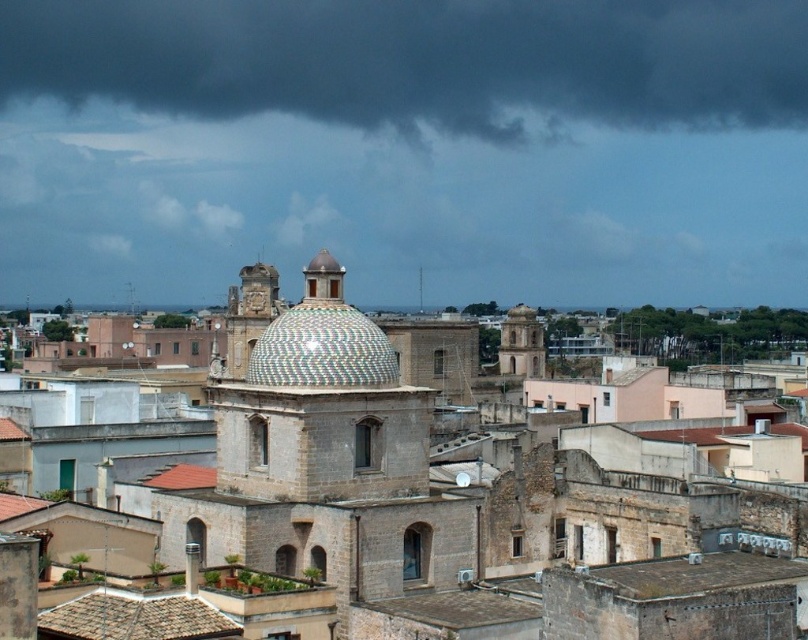
Between point (276, 320) and point (65, 608), which one is positioned in front?

Point (65, 608) is more forward.

Is mosaic tile dome at center to the left of gray shingles roof at lower left from the viewer's perspective?

No, mosaic tile dome at center is not to the left of gray shingles roof at lower left.

From the picture: Measure the distance between point (x=365, y=344) and camera.

Point (x=365, y=344) and camera are 105.99 meters apart.

Identify the location of mosaic tile dome at center. (322, 349).

Does mosaic tile dome at center appear under smooth stone tower at center?

No, mosaic tile dome at center is not below smooth stone tower at center.

Which is behind, point (310, 376) or point (508, 342)?

Positioned behind is point (508, 342).

Who is more distant from viewer, (325, 353) or (518, 308)?

The point (518, 308) is more distant.

The image size is (808, 640). I want to click on mosaic tile dome at center, so click(322, 349).

Based on the photo, is dark gray cloud at upper center wider than smooth stone tower at center?

Correct, the width of dark gray cloud at upper center exceeds that of smooth stone tower at center.

Which of these two, dark gray cloud at upper center or smooth stone tower at center, stands taller?

With more height is dark gray cloud at upper center.

Who is more forward, (306,81) or (541,336)?

Positioned in front is point (541,336).

Locate an element on the screen. This screenshot has height=640, width=808. dark gray cloud at upper center is located at coordinates (419, 61).